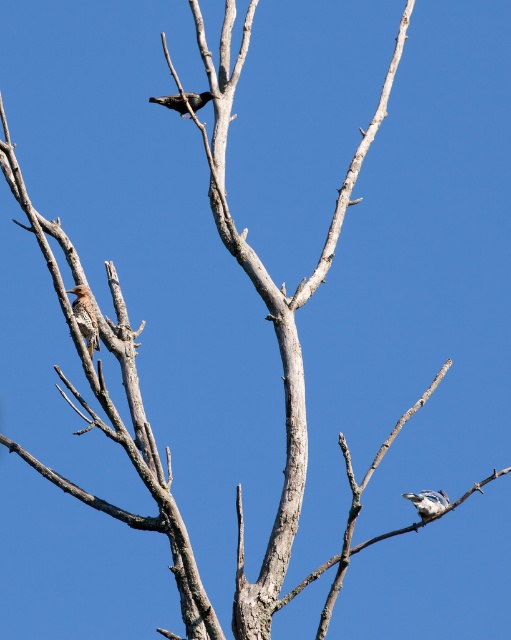
Question: Which point is farther to the camera?

Choices:
 (A) (182, 109)
 (B) (84, 307)

Answer: (A)

Question: Can you confirm if blue glossy bird at lower right is positioned above shiny black bird at upper center?

Choices:
 (A) no
 (B) yes

Answer: (A)

Question: Is speckled brown bird at left wider than shiny black bird at upper center?

Choices:
 (A) no
 (B) yes

Answer: (A)

Question: Considering the real-world distances, which object is farthest from the shiny black bird at upper center?

Choices:
 (A) blue glossy bird at lower right
 (B) speckled brown bird at left

Answer: (A)

Question: Which point is farther to the camera?

Choices:
 (A) (178, 106)
 (B) (85, 336)
 (C) (429, 516)

Answer: (A)

Question: Is blue glossy bird at lower right below shiny black bird at upper center?

Choices:
 (A) yes
 (B) no

Answer: (A)